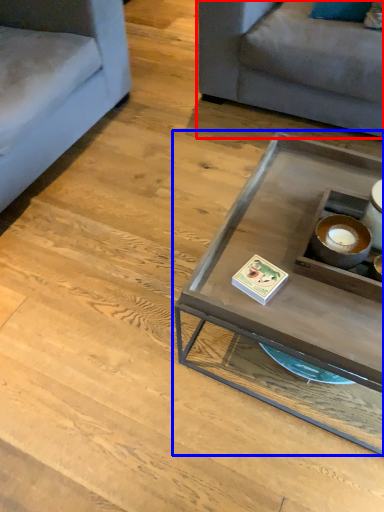
Question: Which object appears closest to the camera in this image, studio couch (highlighted by a red box) or coffee table (highlighted by a blue box)?

Choices:
 (A) studio couch
 (B) coffee table

Answer: (B)